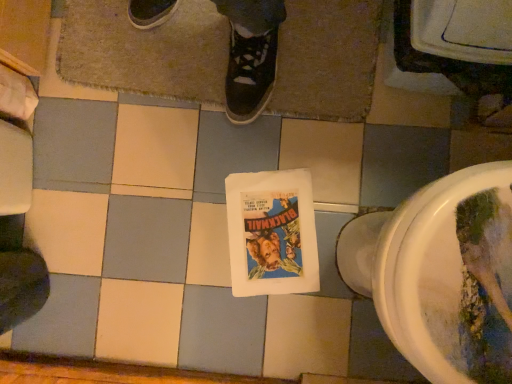
Image resolution: width=512 pixels, height=384 pixels. What do you see at coordinates (272, 233) in the screenshot? I see `matte paper comic book at center` at bounding box center [272, 233].

Locate an element on the screen. The image size is (512, 384). brown textured bath mat at upper center is located at coordinates (146, 50).

What is the approximate width of white glossy toilet at lower right?

white glossy toilet at lower right is 11.44 inches wide.

Where is `matte paper comic book at center`? The width and height of the screenshot is (512, 384). matte paper comic book at center is located at coordinates (272, 233).

Between brown textured bath mat at upper center and matte paper comic book at center, which one has smaller width?

matte paper comic book at center.

Visually, is brown textured bath mat at upper center positioned to the left or to the right of matte paper comic book at center?

brown textured bath mat at upper center is to the left of matte paper comic book at center.

From the image's perspective, is brown textured bath mat at upper center above or below matte paper comic book at center?

Based on their image positions, brown textured bath mat at upper center is located above matte paper comic book at center.

Between point (379, 12) and point (421, 220), which one is positioned in front?

The point (421, 220) is in front.

Is brown textured bath mat at upper center positioned behind white glossy toilet at lower right?

Yes, brown textured bath mat at upper center is further from the viewer.

From their relative heights in the image, would you say brown textured bath mat at upper center is taller or shorter than white glossy toilet at lower right?

brown textured bath mat at upper center is shorter than white glossy toilet at lower right.

Based on the photo, between brown textured bath mat at upper center and white glossy toilet at lower right, which one has smaller size?

brown textured bath mat at upper center is smaller.

Consider the image. Is matte paper comic book at center not within white glossy toilet at lower right?

Yes, matte paper comic book at center is not within white glossy toilet at lower right.

Identify the location of toilet above the matte paper comic book at center (from the image's perspective). Image resolution: width=512 pixels, height=384 pixels. (442, 274).

Considering the relative sizes of matte paper comic book at center and white glossy toilet at lower right in the image provided, is matte paper comic book at center bigger than white glossy toilet at lower right?

No.

From the image's perspective, between matte paper comic book at center and brown textured bath mat at upper center, who is located below?

matte paper comic book at center.

Considering the sizes of objects matte paper comic book at center and brown textured bath mat at upper center in the image provided, who is smaller, matte paper comic book at center or brown textured bath mat at upper center?

Smaller between the two is matte paper comic book at center.

Is brown textured bath mat at upper center at the back of matte paper comic book at center?

No, matte paper comic book at center is not facing the opposite direction of brown textured bath mat at upper center.

Which is more distant, [304,264] or [70,2]?

Point [70,2]

From the image's perspective, which object appears higher, white glossy toilet at lower right or matte paper comic book at center?

white glossy toilet at lower right, from the image's perspective.

Which is more to the left, white glossy toilet at lower right or matte paper comic book at center?

From the viewer's perspective, matte paper comic book at center appears more on the left side.

Does white glossy toilet at lower right contain matte paper comic book at center?

That's incorrect, matte paper comic book at center is not inside white glossy toilet at lower right.

Considering the sizes of objects white glossy toilet at lower right and matte paper comic book at center in the image provided, who is smaller, white glossy toilet at lower right or matte paper comic book at center?

With smaller size is matte paper comic book at center.

Between white glossy toilet at lower right and brown textured bath mat at upper center, which one appears on the right side from the viewer's perspective?

From the viewer's perspective, white glossy toilet at lower right appears more on the right side.

In terms of width, does white glossy toilet at lower right look wider or thinner when compared to brown textured bath mat at upper center?

Considering their sizes, white glossy toilet at lower right looks slimmer than brown textured bath mat at upper center.

Which of these two, white glossy toilet at lower right or brown textured bath mat at upper center, stands shorter?

Standing shorter between the two is brown textured bath mat at upper center.

Measure the distance between white glossy toilet at lower right and brown textured bath mat at upper center.

white glossy toilet at lower right is 19.72 inches away from brown textured bath mat at upper center.

Find the location of a particular element. comic book below the brown textured bath mat at upper center (from a real-world perspective) is located at coordinates (272, 233).

Identify the location of bath mat behind the white glossy toilet at lower right. This screenshot has height=384, width=512. (146, 50).

Looking at the image, which one is located closer to matte paper comic book at center, brown textured bath mat at upper center or white glossy toilet at lower right?

The object closer to matte paper comic book at center is white glossy toilet at lower right.

Based on their spatial positions, is brown textured bath mat at upper center or matte paper comic book at center closer to white glossy toilet at lower right?

matte paper comic book at center.

Estimate the real-world distances between objects in this image. Which object is further from white glossy toilet at lower right, matte paper comic book at center or brown textured bath mat at upper center?

Based on the image, brown textured bath mat at upper center appears to be further to white glossy toilet at lower right.

Based on their spatial positions, is white glossy toilet at lower right or brown textured bath mat at upper center closer to matte paper comic book at center?

white glossy toilet at lower right is closer to matte paper comic book at center.

Consider the image. Which object lies further to the anchor point brown textured bath mat at upper center, matte paper comic book at center or white glossy toilet at lower right?

Among the two, white glossy toilet at lower right is located further to brown textured bath mat at upper center.

Looking at the image, which one is located closer to brown textured bath mat at upper center, white glossy toilet at lower right or matte paper comic book at center?

matte paper comic book at center.

Find the location of a particular element. bath mat positioned between white glossy toilet at lower right and matte paper comic book at center from near to far is located at coordinates (146, 50).